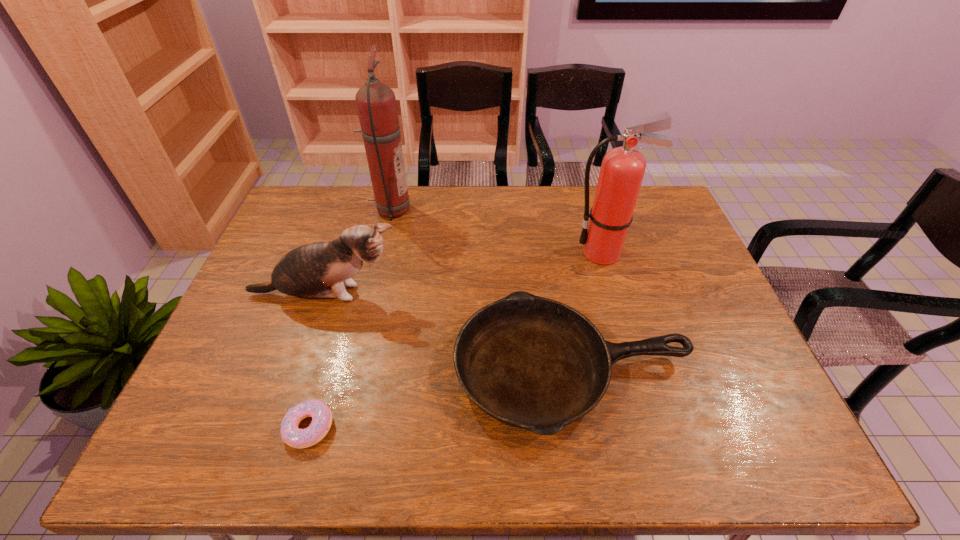
Where is `vacant region between the right fire extinguisher and the second shortest object`? The width and height of the screenshot is (960, 540). vacant region between the right fire extinguisher and the second shortest object is located at coordinates (588, 312).

The image size is (960, 540). Identify the location of free area in between the shortest object and the frying pan. (441, 399).

Choose which object is the nearest neighbor to the shortest object. Please provide its 2D coordinates. Your answer should be formatted as a tuple, i.e. [(x, y)], where the tuple contains the x and y coordinates of a point satisfying the conditions above.

[(530, 362)]

This screenshot has height=540, width=960. What are the coordinates of `the second closest object to the shortest object` in the screenshot? It's located at (304, 272).

You are a GUI agent. You are given a task and a screenshot of the screen. Output one action in this format:
    pyautogui.click(x=<x>, y=<y>)
    Task: Click on the blank space that satisfies the following two spatial constraints: 1. at the face of the third tallest object; 2. on the right side of the doughnut
    
    Given the screenshot: What is the action you would take?
    pyautogui.click(x=280, y=427)

I want to click on vacant space that satisfies the following two spatial constraints: 1. at the face of the cat; 2. on the left side of the shortest object, so click(x=280, y=427).

Image resolution: width=960 pixels, height=540 pixels. I want to click on free space that satisfies the following two spatial constraints: 1. at the face of the doughnut; 2. on the right side of the cat, so click(x=280, y=427).

Identify the location of free space that satisfies the following two spatial constraints: 1. on the back side of the frying pan; 2. on the left side of the doughnut. This screenshot has width=960, height=540. (325, 370).